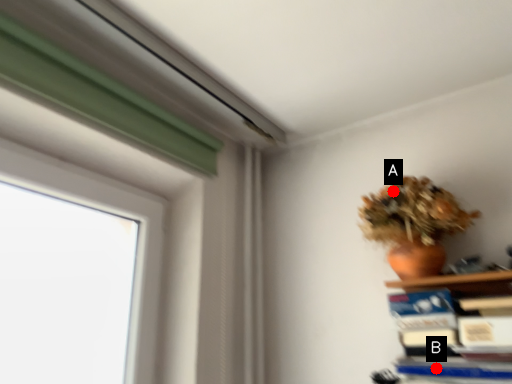
Question: Two points are circled on the image, labeled by A and B beside each circle. Which point appears farthest from the camera in this image?

Choices:
 (A) A is further
 (B) B is further

Answer: (A)